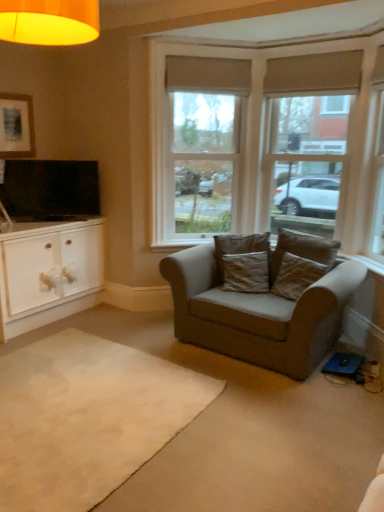
Question: Does brown suede pillow at center, arranged as the 2th pillow when viewed from the right, turn towards brown fabric pillow at center, placed as the third pillow when sorted from right to left?

Choices:
 (A) no
 (B) yes

Answer: (A)

Question: Considering the relative sizes of brown suede pillow at center, arranged as the 2th pillow when viewed from the right, and brown fabric pillow at center, placed as the third pillow when sorted from right to left, in the image provided, is brown suede pillow at center, arranged as the 2th pillow when viewed from the right, wider than brown fabric pillow at center, placed as the third pillow when sorted from right to left,?

Choices:
 (A) yes
 (B) no

Answer: (B)

Question: Is brown suede pillow at center, arranged as the 2th pillow when viewed from the right, bigger than brown fabric pillow at center, placed as the third pillow when sorted from right to left?

Choices:
 (A) no
 (B) yes

Answer: (A)

Question: Considering the relative sizes of brown suede pillow at center, arranged as the 2th pillow when viewed from the right, and brown fabric pillow at center, placed as the third pillow when sorted from right to left, in the image provided, is brown suede pillow at center, arranged as the 2th pillow when viewed from the right, thinner than brown fabric pillow at center, placed as the third pillow when sorted from right to left,?

Choices:
 (A) yes
 (B) no

Answer: (A)

Question: Is brown suede pillow at center, arranged as the 2th pillow when viewed from the right, outside of brown fabric pillow at center, the first pillow positioned from the left?

Choices:
 (A) yes
 (B) no

Answer: (A)

Question: Is flat screen tv at left bigger or smaller than white wood cabinet at left?

Choices:
 (A) big
 (B) small

Answer: (B)

Question: Considering the positions of flat screen tv at left and white wood cabinet at left in the image, is flat screen tv at left taller or shorter than white wood cabinet at left?

Choices:
 (A) tall
 (B) short

Answer: (B)

Question: Considering their positions, is flat screen tv at left located in front of or behind white wood cabinet at left?

Choices:
 (A) behind
 (B) front

Answer: (A)

Question: Is flat screen tv at left wider or thinner than white wood cabinet at left?

Choices:
 (A) wide
 (B) thin

Answer: (B)

Question: Would you say suede gray couch at center is to the left or to the right of brown suede pillow at center, positioned as the first pillow in right-to-left order, in the picture?

Choices:
 (A) right
 (B) left

Answer: (B)

Question: From a real-world perspective, relative to brown suede pillow at center, placed as the 3th pillow when sorted from left to right, is suede gray couch at center vertically above or below?

Choices:
 (A) below
 (B) above

Answer: (A)

Question: Choose the correct answer: Is suede gray couch at center inside brown suede pillow at center, placed as the 3th pillow when sorted from left to right, or outside it?

Choices:
 (A) inside
 (B) outside

Answer: (B)

Question: Is suede gray couch at center taller or shorter than brown suede pillow at center, placed as the 3th pillow when sorted from left to right?

Choices:
 (A) short
 (B) tall

Answer: (B)

Question: From the image's perspective, is brown suede pillow at center, arranged as the 2th pillow when viewed from the right, above or below brown fabric pillow at center, the first pillow positioned from the left?

Choices:
 (A) above
 (B) below

Answer: (B)

Question: In the image, is brown suede pillow at center, which appears as the second pillow when viewed from the left, positioned in front of or behind brown fabric pillow at center, placed as the third pillow when sorted from right to left?

Choices:
 (A) behind
 (B) front

Answer: (B)